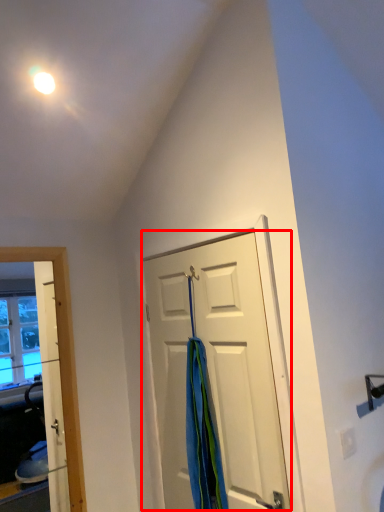
Question: From the image's perspective, what is the correct spatial positioning of door (annotated by the red box) in reference to shower curtain?

Choices:
 (A) below
 (B) above

Answer: (B)